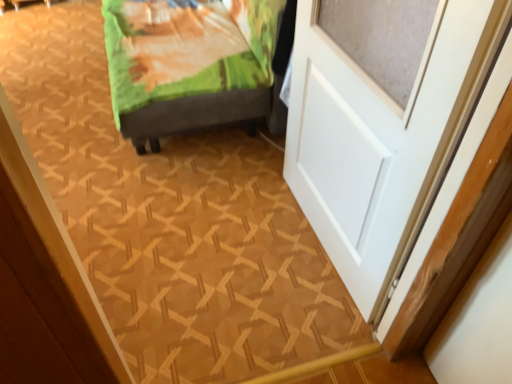
You are a GUI agent. You are given a task and a screenshot of the screen. Output one action in this format:
    pyautogui.click(x=<x>, y=<y>)
    Task: Click on the white matte door at right
    
    Given the screenshot: What is the action you would take?
    pyautogui.click(x=381, y=138)

What do you see at coordinates (381, 138) in the screenshot? This screenshot has height=384, width=512. I see `white matte door at right` at bounding box center [381, 138].

What do you see at coordinates (188, 64) in the screenshot? This screenshot has width=512, height=384. I see `green fabric bed at upper left` at bounding box center [188, 64].

You are a GUI agent. You are given a task and a screenshot of the screen. Output one action in this format:
    pyautogui.click(x=<x>, y=<y>)
    Task: Click on the green fabric bed at upper left
    
    Given the screenshot: What is the action you would take?
    pyautogui.click(x=188, y=64)

What is the approximate width of green fabric bed at upper left?

It is 88.17 centimeters.

This screenshot has height=384, width=512. What are the coordinates of `white matte door at right` in the screenshot? It's located at (381, 138).

Which is more to the right, white matte door at right or green fabric bed at upper left?

Positioned to the right is white matte door at right.

Considering the relative positions of white matte door at right and green fabric bed at upper left in the image provided, is white matte door at right behind green fabric bed at upper left?

No.

Considering the positions of point (398, 19) and point (217, 118), is point (398, 19) closer or farther from the camera than point (217, 118)?

Point (398, 19).

From the image's perspective, is white matte door at right on top of green fabric bed at upper left?

No.

In the scene shown: From a real-world perspective, is white matte door at right above or below green fabric bed at upper left?

Clearly, from a real-world perspective, white matte door at right is above green fabric bed at upper left.

Looking at their sizes, would you say white matte door at right is wider or thinner than green fabric bed at upper left?

white matte door at right is thinner than green fabric bed at upper left.

In terms of height, does white matte door at right look taller or shorter compared to green fabric bed at upper left?

Considering their sizes, white matte door at right has more height than green fabric bed at upper left.

Is white matte door at right bigger or smaller than green fabric bed at upper left?

white matte door at right is smaller than green fabric bed at upper left.

Consider the image. Does white matte door at right contain green fabric bed at upper left?

No, green fabric bed at upper left is not inside white matte door at right.

Would you say white matte door at right is a long distance from green fabric bed at upper left?

No, there isn't a large distance between white matte door at right and green fabric bed at upper left.

Based on the photo, could you tell me if white matte door at right is turned towards green fabric bed at upper left?

No, white matte door at right is not facing towards green fabric bed at upper left.

Can you tell me how much white matte door at right and green fabric bed at upper left differ in facing direction?

They differ by 3.15 degrees in their facing directions.

You are a GUI agent. You are given a task and a screenshot of the screen. Output one action in this format:
    pyautogui.click(x=<x>, y=<y>)
    Task: Click on the door that is in front of the green fabric bed at upper left
    
    Given the screenshot: What is the action you would take?
    pyautogui.click(x=381, y=138)

Consider the image. Which object is positioned more to the left, green fabric bed at upper left or white matte door at right?

green fabric bed at upper left is more to the left.

Does green fabric bed at upper left lie in front of white matte door at right?

No, green fabric bed at upper left is further to the viewer.

Which is farther, (102, 6) or (425, 101)?

The point (102, 6) is farther from the camera.

From the image's perspective, is green fabric bed at upper left over white matte door at right?

Yes, from the image's perspective, green fabric bed at upper left is on top of white matte door at right.

From a real-world perspective, which is physically below, green fabric bed at upper left or white matte door at right?

green fabric bed at upper left is physically lower.

In the scene shown: Can you confirm if green fabric bed at upper left is thinner than white matte door at right?

No, green fabric bed at upper left is not thinner than white matte door at right.

Considering the sizes of objects green fabric bed at upper left and white matte door at right in the image provided, who is taller, green fabric bed at upper left or white matte door at right?

white matte door at right.

Which of these two, green fabric bed at upper left or white matte door at right, is bigger?

green fabric bed at upper left.

From the picture: Is green fabric bed at upper left completely or partially outside of white matte door at right?

Indeed, green fabric bed at upper left is completely outside white matte door at right.

Are green fabric bed at upper left and white matte door at right making contact?

No, green fabric bed at upper left is not beside white matte door at right.

Is white matte door at right at the back of green fabric bed at upper left?

No.

Can you tell me how much green fabric bed at upper left and white matte door at right differ in facing direction?

The angular difference between green fabric bed at upper left and white matte door at right is 3.15 degrees.

Image resolution: width=512 pixels, height=384 pixels. In the image, there is a green fabric bed at upper left. Identify the location of door below it (from the image's perspective). pyautogui.click(x=381, y=138).

Locate an element on the screen. The height and width of the screenshot is (384, 512). furniture on the left of the white matte door at right is located at coordinates (188, 64).

The image size is (512, 384). In order to click on furniture lying behind the white matte door at right in this screenshot , I will do `click(188, 64)`.